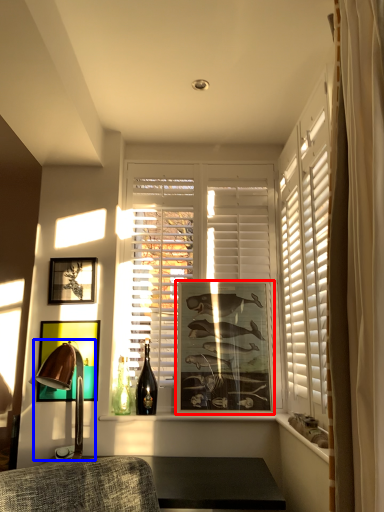
Question: Which object appears closest to the camera in this image, picture frame (highlighted by a red box) or table lamp (highlighted by a blue box)?

Choices:
 (A) picture frame
 (B) table lamp

Answer: (B)